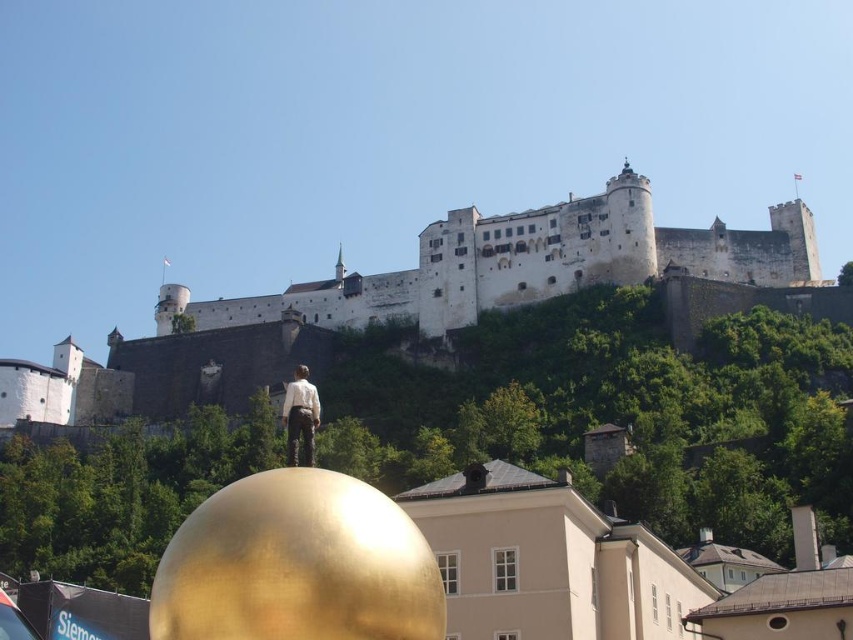
Question: Is white stone castle at upper center below matte white shirt at center?

Choices:
 (A) yes
 (B) no

Answer: (B)

Question: In this image, where is white stone castle at upper center located relative to matte white shirt at center?

Choices:
 (A) left
 (B) right

Answer: (B)

Question: Which point appears farthest from the camera in this image?

Choices:
 (A) (310, 408)
 (B) (813, 275)

Answer: (B)

Question: Which point is closer to the camera?

Choices:
 (A) matte white shirt at center
 (B) white stone castle at upper center

Answer: (A)

Question: Which point is closer to the camera?

Choices:
 (A) (532, 216)
 (B) (288, 464)

Answer: (B)

Question: Does white stone castle at upper center have a greater width compared to matte white shirt at center?

Choices:
 (A) yes
 (B) no

Answer: (A)